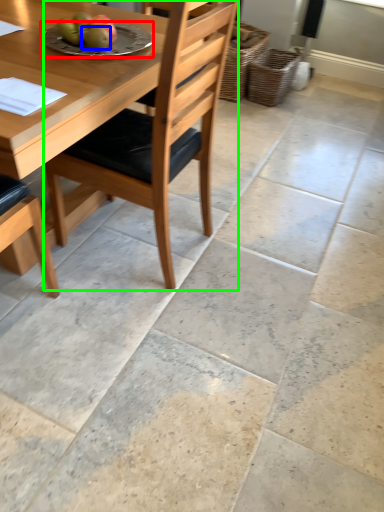
Question: Based on their relative distances, which object is nearer to plate (highlighted by a red box)? Choose from fruit (highlighted by a blue box) and chair (highlighted by a green box).

Choices:
 (A) fruit
 (B) chair

Answer: (A)